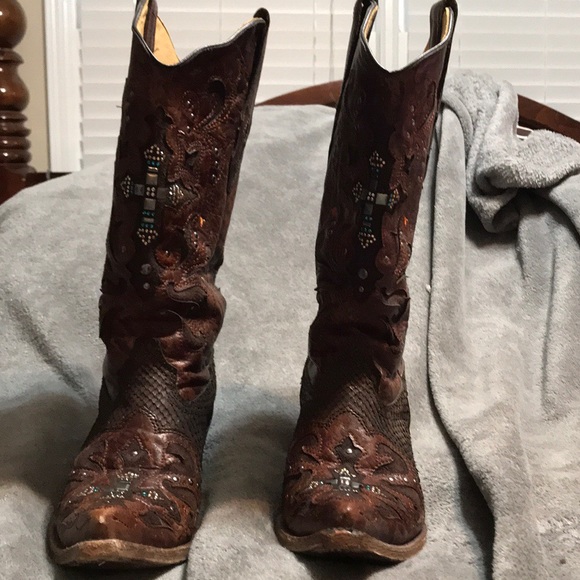
The width and height of the screenshot is (580, 580). I want to click on blanket, so click(517, 350).